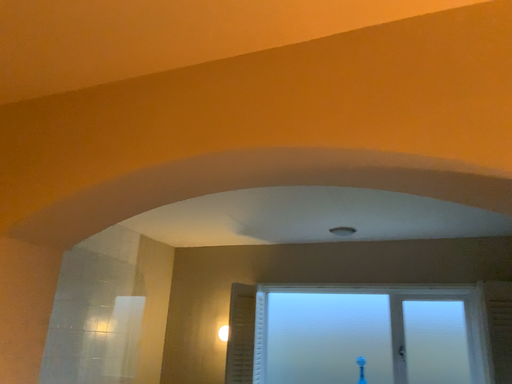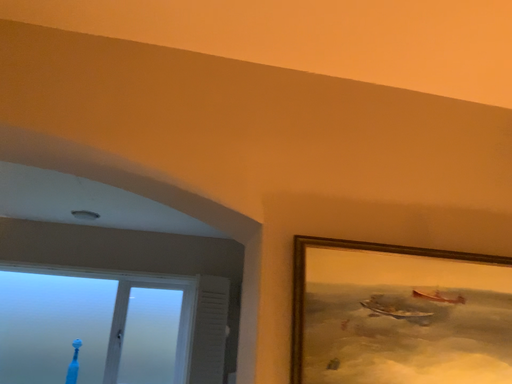
Question: Which way did the camera rotate in the video?

Choices:
 (A) rotated left
 (B) rotated right

Answer: (B)